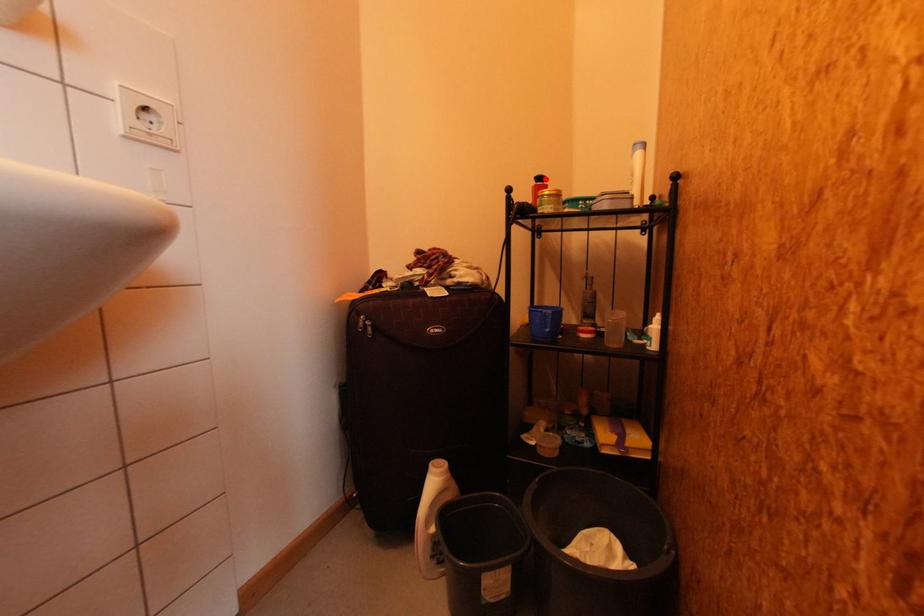
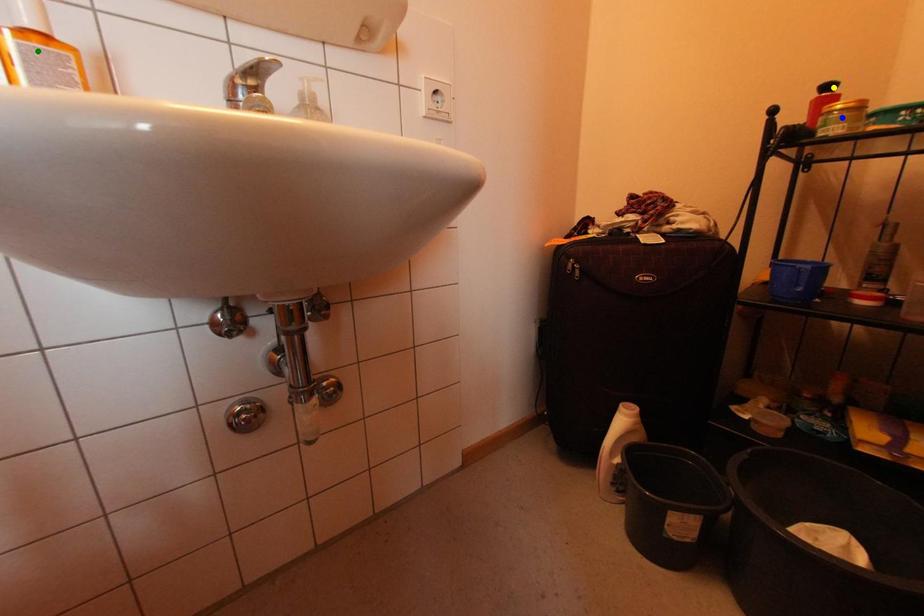
Question: I am providing you with two images of the same scene from different viewpoints. A red point is marked on the first image. You are given multiple points on the second image. Which point in image 2 represents the same 3d spot as the red point in image 1?

Choices:
 (A) green point
 (B) yellow point
 (C) blue point

Answer: (B)